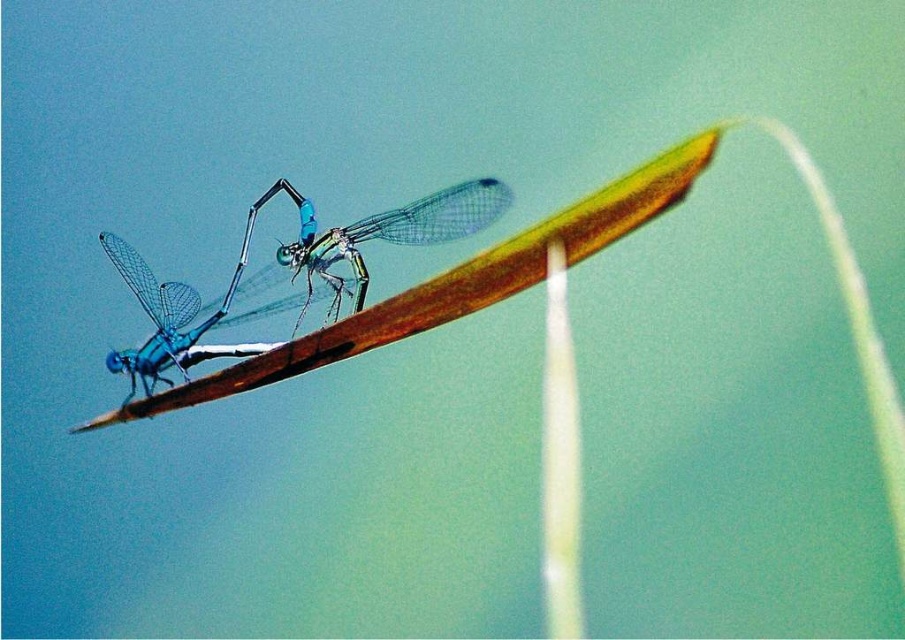
Does translucent glass dragonfly at center appear over translucent blue dragonfly at center?

Yes.

Which is in front, point (310, 262) or point (118, 356)?

Point (118, 356)

Is point (237, 266) positioned behind point (191, 305)?

No, it is in front of (191, 305).

I want to click on translucent glass dragonfly at center, so click(362, 241).